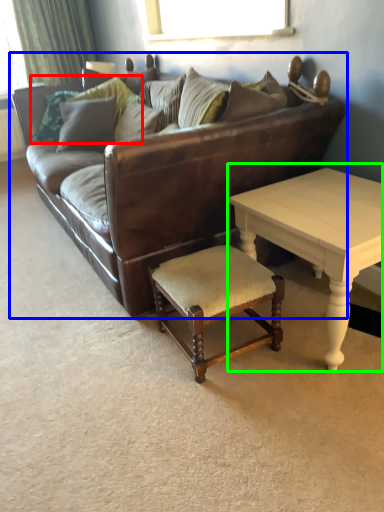
Question: Which is nearer to the pillow (highlighted by a red box)? studio couch (highlighted by a blue box) or coffee table (highlighted by a green box).

Choices:
 (A) studio couch
 (B) coffee table

Answer: (A)